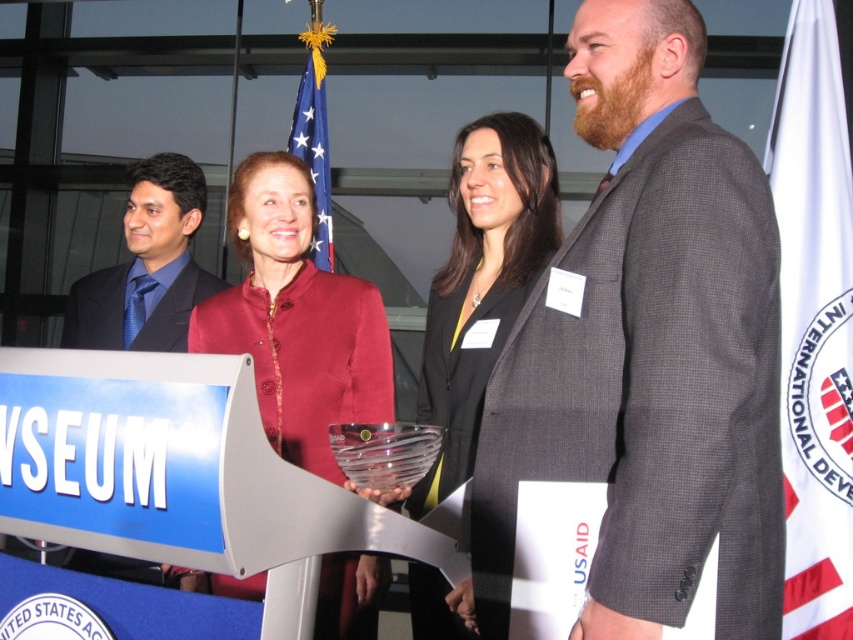
Is point (728, 492) positioned after point (141, 332)?

No.

Who is more distant from viewer, [695,422] or [88,282]?

The point [88,282] is behind.

This screenshot has width=853, height=640. What are the coordinates of `gray checkered suit at center` in the screenshot? It's located at (647, 353).

Can you confirm if gray checkered suit at center is positioned below black satin blazer at center?

No, gray checkered suit at center is not below black satin blazer at center.

How much distance is there between gray checkered suit at center and black satin blazer at center?

They are 25.49 inches apart.

Describe the element at coordinates (647, 353) in the screenshot. Image resolution: width=853 pixels, height=640 pixels. I see `gray checkered suit at center` at that location.

In order to click on gray checkered suit at center in this screenshot , I will do `click(647, 353)`.

Between point (338, 596) and point (318, 236), which one is positioned behind?

Positioned behind is point (318, 236).

Is point (287, 276) positioned before point (321, 33)?

Yes, point (287, 276) is closer to viewer.

Where is `maroon satin blouse at center`? This screenshot has height=640, width=853. maroon satin blouse at center is located at coordinates (296, 320).

The height and width of the screenshot is (640, 853). Identify the location of maroon satin blouse at center. (296, 320).